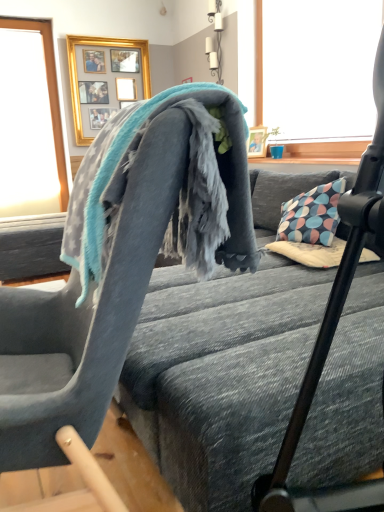
Question: Is transparent glass window at upper left closer to the viewer compared to soft gray fabric chair at upper center?

Choices:
 (A) no
 (B) yes

Answer: (A)

Question: Considering the relative sizes of transparent glass window at upper left and soft gray fabric chair at upper center in the image provided, is transparent glass window at upper left shorter than soft gray fabric chair at upper center?

Choices:
 (A) yes
 (B) no

Answer: (B)

Question: Is transparent glass window at upper left directly adjacent to soft gray fabric chair at upper center?

Choices:
 (A) no
 (B) yes

Answer: (A)

Question: From the image's perspective, is transparent glass window at upper left over soft gray fabric chair at upper center?

Choices:
 (A) no
 (B) yes

Answer: (B)

Question: Does transparent glass window at upper left have a greater height compared to soft gray fabric chair at upper center?

Choices:
 (A) yes
 (B) no

Answer: (A)

Question: Is soft gray fabric bed frame at center situated inside soft gray fabric chair at upper center or outside?

Choices:
 (A) outside
 (B) inside

Answer: (A)

Question: Based on their positions, is soft gray fabric bed frame at center located to the left or right of soft gray fabric chair at upper center?

Choices:
 (A) left
 (B) right

Answer: (B)

Question: From the image's perspective, is soft gray fabric bed frame at center above or below soft gray fabric chair at upper center?

Choices:
 (A) above
 (B) below

Answer: (A)

Question: Considering the positions of soft gray fabric bed frame at center and soft gray fabric chair at upper center in the image, is soft gray fabric bed frame at center wider or thinner than soft gray fabric chair at upper center?

Choices:
 (A) thin
 (B) wide

Answer: (B)

Question: In terms of height, does soft gray fabric bed frame at center look taller or shorter compared to gray fleece blanket at center?

Choices:
 (A) tall
 (B) short

Answer: (A)

Question: In the image, is soft gray fabric bed frame at center positioned in front of or behind gray fleece blanket at center?

Choices:
 (A) front
 (B) behind

Answer: (A)

Question: In terms of width, does soft gray fabric bed frame at center look wider or thinner when compared to gray fleece blanket at center?

Choices:
 (A) wide
 (B) thin

Answer: (A)

Question: Is soft gray fabric bed frame at center to the left or to the right of gray fleece blanket at center in the image?

Choices:
 (A) left
 (B) right

Answer: (B)

Question: Is soft gray fabric bed frame at center inside the boundaries of transparent glass window at upper left, or outside?

Choices:
 (A) inside
 (B) outside

Answer: (B)

Question: From the image's perspective, is soft gray fabric bed frame at center located above or below transparent glass window at upper left?

Choices:
 (A) below
 (B) above

Answer: (A)